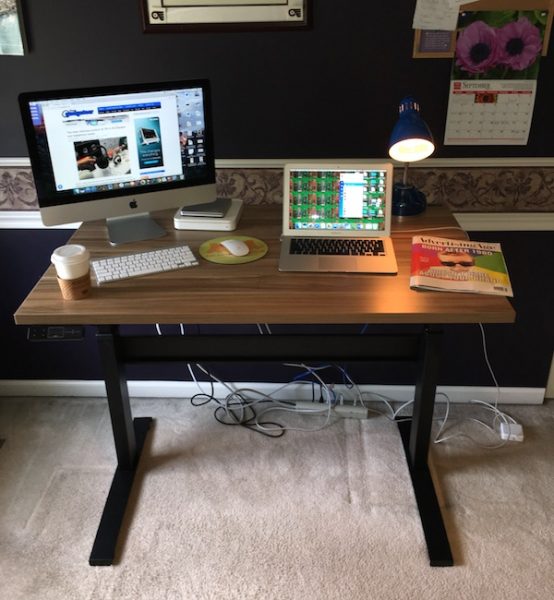
The height and width of the screenshot is (600, 554). Identify the location of calendar. (488, 126).